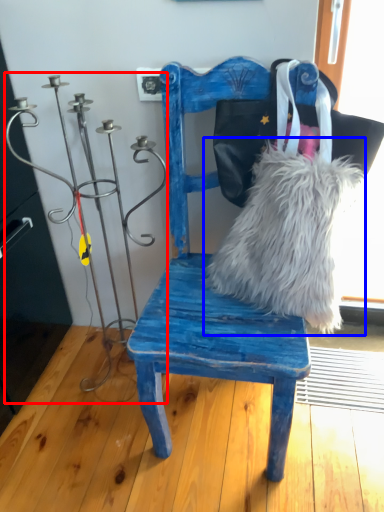
Question: Among these objects, which one is farthest to the camera, candle holder (highlighted by a red box) or fur (highlighted by a blue box)?

Choices:
 (A) candle holder
 (B) fur

Answer: (B)